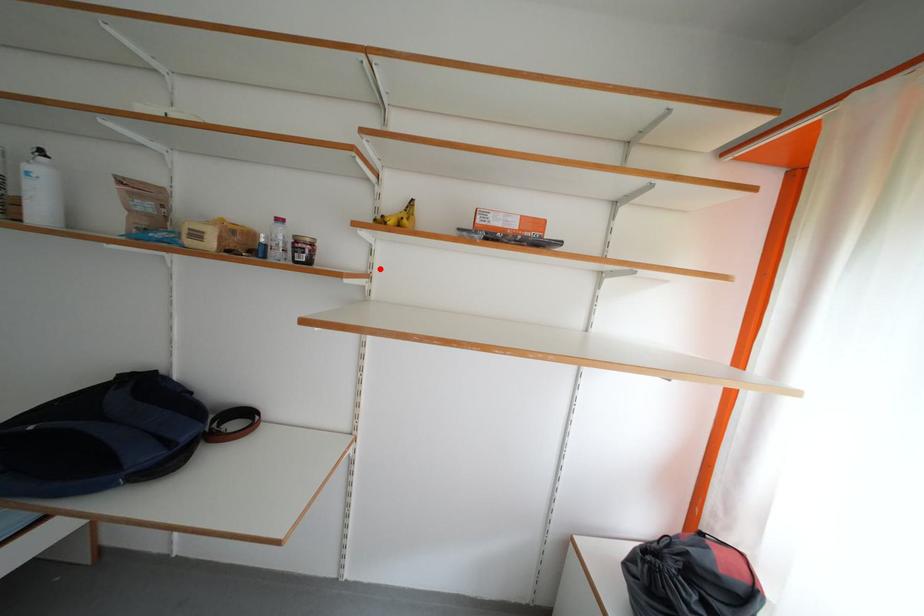
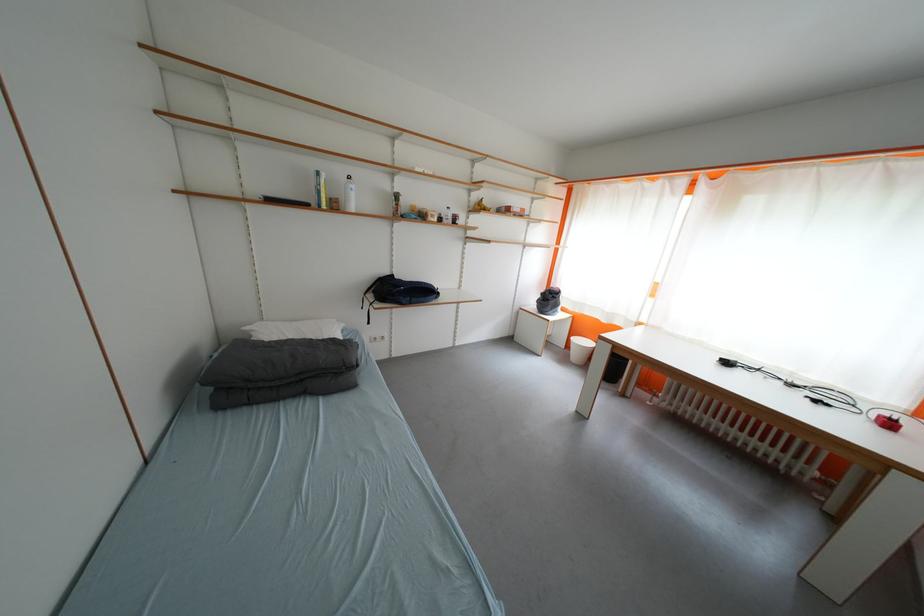
Where in the second image is the point corresponding to the highlighted location from the first image?

(476, 225)